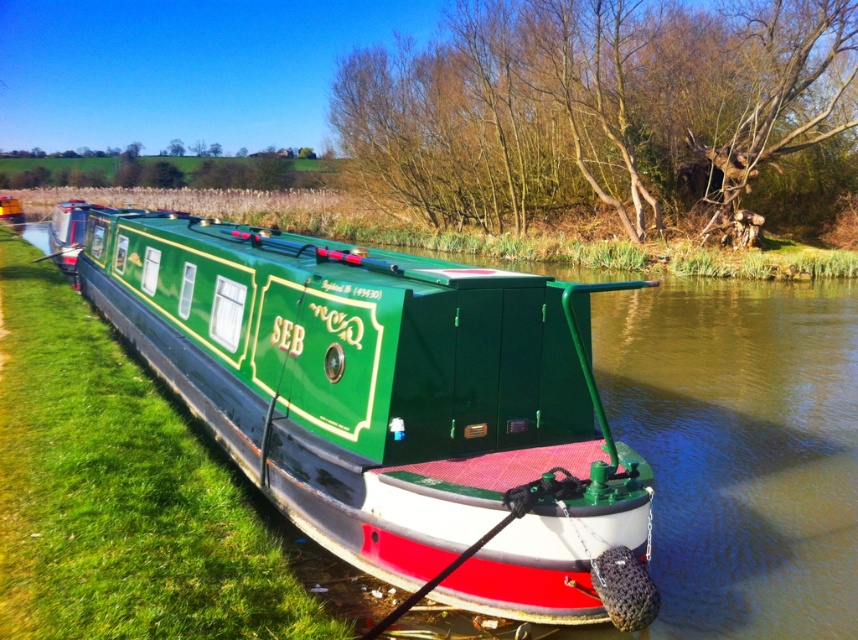
Measure the distance from green glossy canal boat at center to green grass at left.

A distance of 7.09 feet exists between green glossy canal boat at center and green grass at left.

Does green glossy canal boat at center appear under green grass at left?

No.

Which is in front, point (497, 291) or point (4, 529)?

Point (4, 529)

What are the coordinates of `green glossy canal boat at center` in the screenshot? It's located at (x=396, y=406).